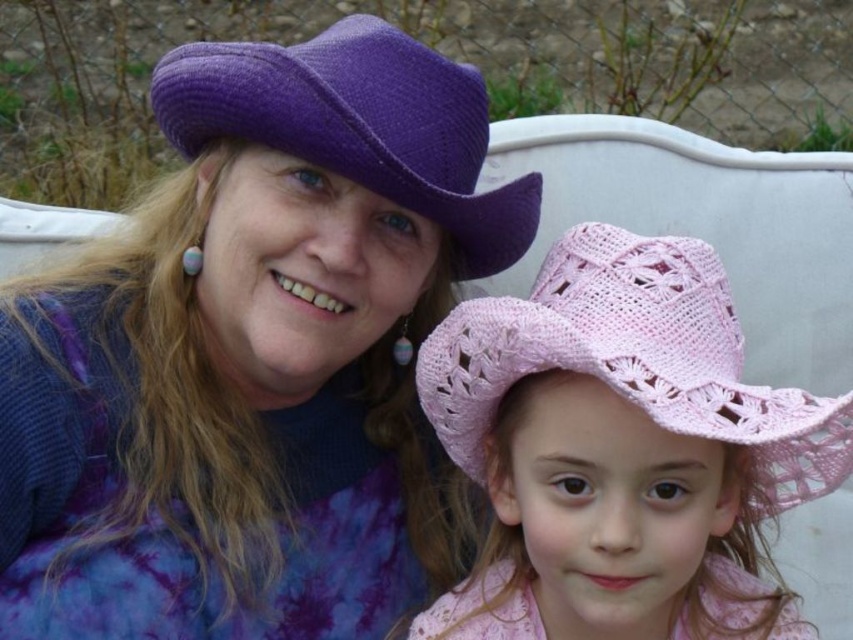
Question: Which of the following is the farthest from the observer?

Choices:
 (A) (425, 61)
 (B) (457, 346)
 (C) (45, 515)

Answer: (A)

Question: Which object is the farthest from the purple knitted hat at upper left?

Choices:
 (A) pink crocheted cowboy hat at right
 (B) purple woven cowboy hat at upper left

Answer: (A)

Question: Considering the relative positions of purple knitted hat at upper left and purple woven cowboy hat at upper left in the image provided, where is purple knitted hat at upper left located with respect to purple woven cowboy hat at upper left?

Choices:
 (A) left
 (B) right

Answer: (A)

Question: Can you confirm if pink crocheted cowboy hat at right is positioned to the left of purple woven cowboy hat at upper left?

Choices:
 (A) no
 (B) yes

Answer: (A)

Question: Which of the following is the farthest from the observer?

Choices:
 (A) (201, 576)
 (B) (602, 368)
 (C) (347, 36)

Answer: (A)

Question: Is purple knitted hat at upper left in front of purple woven cowboy hat at upper left?

Choices:
 (A) yes
 (B) no

Answer: (B)